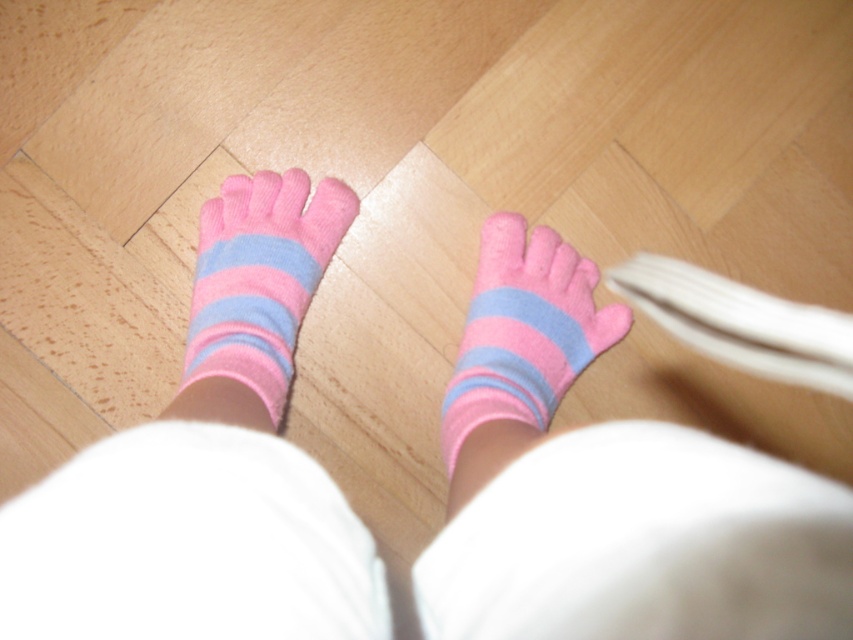
Which is above, pink soft socks at center or pink fuzzy socks at center?

Positioned higher is pink fuzzy socks at center.

Between point (540, 406) and point (548, 387), which one is positioned behind?

Point (548, 387)

Which is in front, point (502, 292) or point (485, 291)?

Positioned in front is point (502, 292).

Where is `pink soft socks at center`? Image resolution: width=853 pixels, height=640 pixels. pink soft socks at center is located at coordinates (607, 492).

Is point (233, 332) positioned before point (550, 378)?

That is True.

Does pink fuzzy socks at left appear on the right side of pink fuzzy socks at center?

No, pink fuzzy socks at left is not to the right of pink fuzzy socks at center.

Who is more distant from viewer, [341,204] or [535,305]?

The point [341,204] is behind.

Locate an element on the screen. pink fuzzy socks at left is located at coordinates (257, 284).

In the scene shown: Between pink soft socks at center and pink fuzzy socks at left, which one is positioned higher?

Positioned higher is pink fuzzy socks at left.

Between pink soft socks at center and pink fuzzy socks at left, which one has less height?

With less height is pink fuzzy socks at left.

Measure the distance between point [550,531] and camera.

12.24 inches

The width and height of the screenshot is (853, 640). Identify the location of pink soft socks at center. (607, 492).